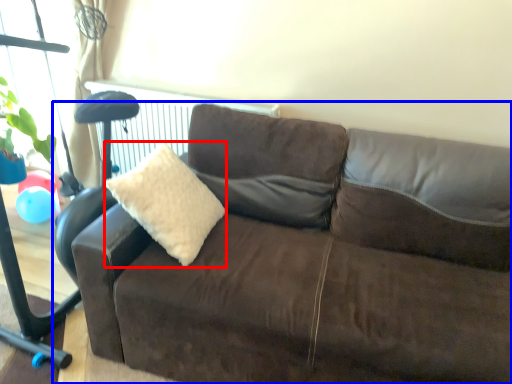
Question: Among these objects, which one is nearest to the camera, throw pillow (highlighted by a red box) or studio couch (highlighted by a blue box)?

Choices:
 (A) throw pillow
 (B) studio couch

Answer: (B)